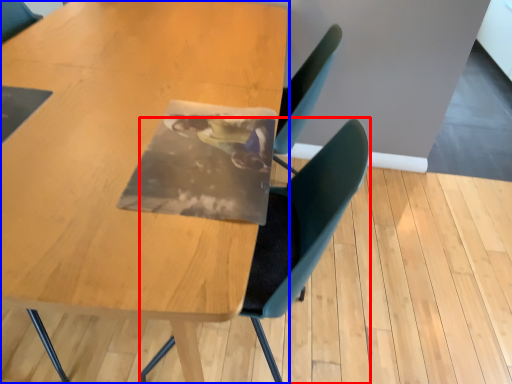
Question: Among these objects, which one is farthest to the camera, chair (highlighted by a red box) or table (highlighted by a blue box)?

Choices:
 (A) chair
 (B) table

Answer: (A)